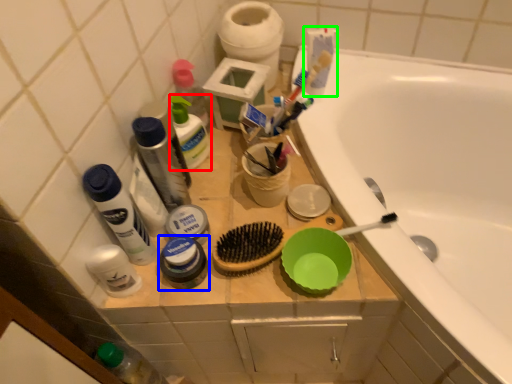
Question: Which is nearer to the cleaning product (highlighted by a red box)? toiletry (highlighted by a blue box) or toothpaste (highlighted by a green box).

Choices:
 (A) toiletry
 (B) toothpaste

Answer: (A)